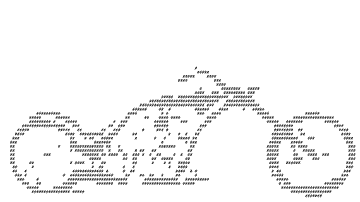
You are a GUI agent. You are given a task and a screenshot of the screen. Output one action in this format:
    pyautogui.click(x=<x>, y=<y>)
    Task: Click on the bottom frame
    This screenshot has width=360, height=202.
    Given the screenshot: What is the action you would take?
    pyautogui.click(x=183, y=183)